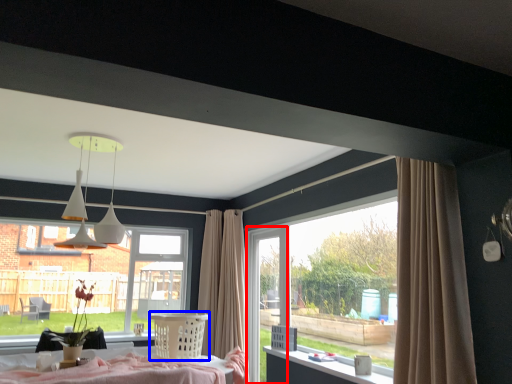
Question: Which object appears closest to the camera in this image, screen door (highlighted by a red box) or furniture (highlighted by a blue box)?

Choices:
 (A) screen door
 (B) furniture

Answer: (B)